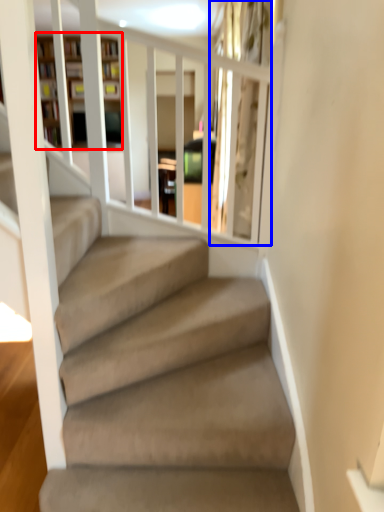
Question: Which of the following is the closest to the observer, bookshelf (highlighted by a red box) or glass door (highlighted by a blue box)?

Choices:
 (A) bookshelf
 (B) glass door

Answer: (B)